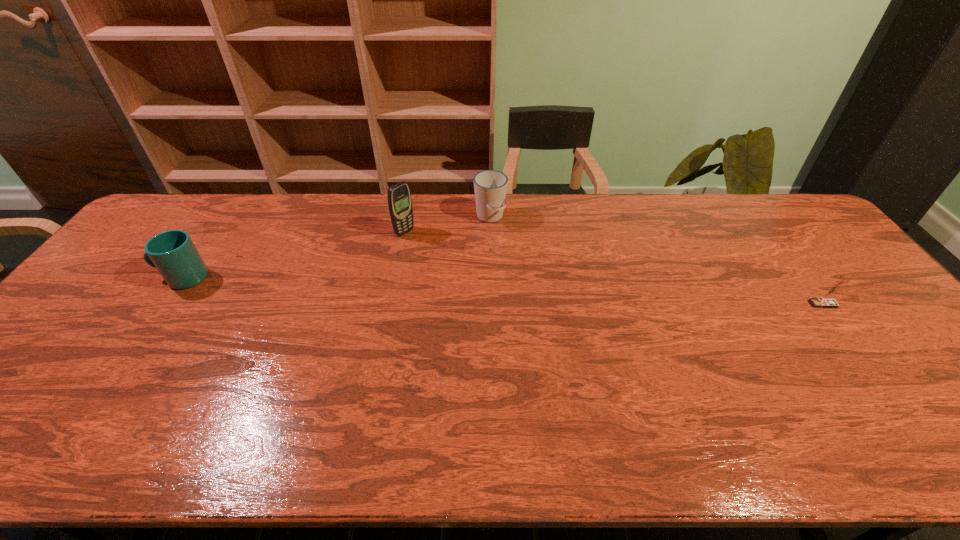
Find the location of a particular element. vacant space in between the right cup and the cellular telephone is located at coordinates (447, 225).

At what (x,y) coordinates should I click in order to perform the action: click on unoccupied position between the third object from left to right and the tallest object. Please return your answer as a coordinate pair (x, y). The image size is (960, 540). Looking at the image, I should click on (447, 225).

This screenshot has width=960, height=540. Identify the location of free space between the nearer cup and the tallest object. coord(294,255).

I want to click on vacant point located between the right cup and the left cup, so click(x=336, y=247).

The height and width of the screenshot is (540, 960). I want to click on the third closest object relative to the tallest object, so click(829, 302).

Choose which object is the nearest neighbor to the third object from left to right. Please provide its 2D coordinates. Your answer should be formatted as a tuple, i.e. [(x, y)], where the tuple contains the x and y coordinates of a point satisfying the conditions above.

[(399, 196)]